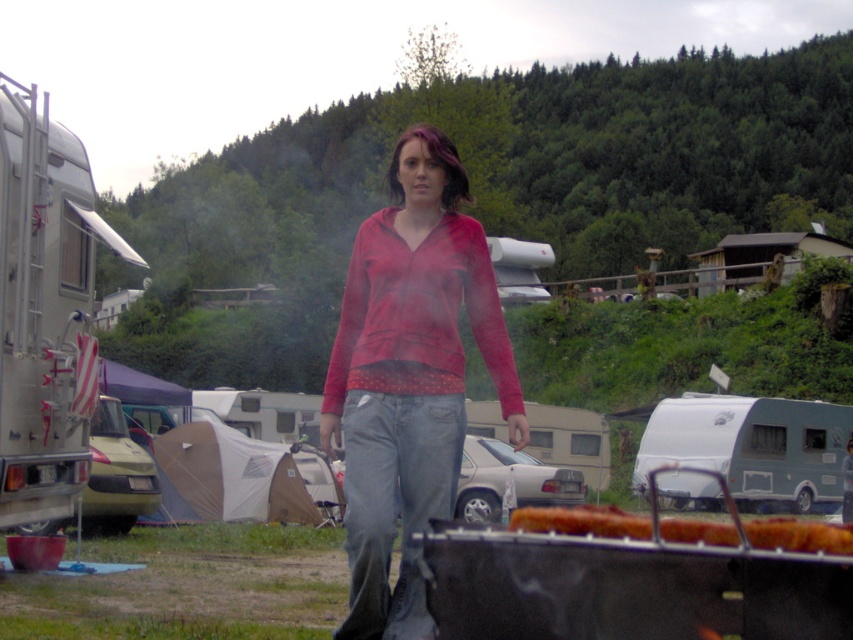
You are a photographer positioned to the right of the scene. You want to capture both the silver metallic trailer at left and the silver metallic trailer at center in your shot. Which trailer should you aim your camera upwards to include in the frame?

To include both trailers in your shot, you should aim your camera upwards toward the silver metallic trailer at left, since it is positioned above the silver metallic trailer at center.

You are a photographer positioned to the left of the scene. You want to capture a photo that includes both the matte red hoodie at center and the golden crispy bread at lower center. Which object should you focus on first to ensure both are in frame?

The matte red hoodie at center is located above the golden crispy bread at lower center, so you should focus on the matte red hoodie at center first to ensure both are in frame.

You are a hiker trying to locate the tent from the scene. You see the silver metallic trailer at left and the silver metallic trailer at center. Which trailer is closer to the tent?

The silver metallic trailer at left is closer to the tent because it is positioned in front of the silver metallic trailer at center, meaning it is nearer to the viewer and likely closer to the tent located on the left side.